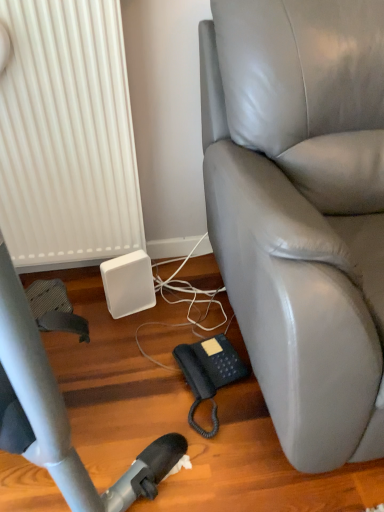
Locate an element on the screen. The width and height of the screenshot is (384, 512). free space between black rubberized phone at lower center and white matte speaker at lower left is located at coordinates (160, 343).